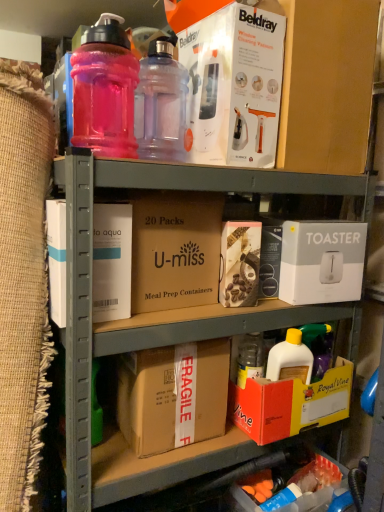
Question: Does orange cardboard box at lower right, the fourth box when ordered from top to bottom, have a lesser width compared to orange cardboard box at lower right, which is the 5th box from top to bottom?

Choices:
 (A) no
 (B) yes

Answer: (A)

Question: Is orange cardboard box at lower right, which is counted as the second box, starting from the bottom, not inside orange cardboard box at lower right, arranged as the first box when ordered from the bottom?

Choices:
 (A) no
 (B) yes

Answer: (B)

Question: From the image's perspective, is orange cardboard box at lower right, the fourth box when ordered from top to bottom, on top of orange cardboard box at lower right, arranged as the first box when ordered from the bottom?

Choices:
 (A) no
 (B) yes

Answer: (B)

Question: Can you confirm if orange cardboard box at lower right, the fourth box when ordered from top to bottom, is positioned to the right of orange cardboard box at lower right, which is the 5th box from top to bottom?

Choices:
 (A) yes
 (B) no

Answer: (B)

Question: Is orange cardboard box at lower right, which is counted as the second box, starting from the bottom, positioned with its back to orange cardboard box at lower right, arranged as the first box when ordered from the bottom?

Choices:
 (A) yes
 (B) no

Answer: (B)

Question: Considering the positions of orange cardboard box at lower right, which is the 5th box from top to bottom, and translucent pink plastic bottle at upper left, the 2th bottle positioned from the right, in the image, is orange cardboard box at lower right, which is the 5th box from top to bottom, taller or shorter than translucent pink plastic bottle at upper left, the 2th bottle positioned from the right,?

Choices:
 (A) tall
 (B) short

Answer: (B)

Question: From the image's perspective, is orange cardboard box at lower right, arranged as the first box when ordered from the bottom, located above or below translucent pink plastic bottle at upper left, the 2th bottle positioned from the right?

Choices:
 (A) below
 (B) above

Answer: (A)

Question: From a real-world perspective, is orange cardboard box at lower right, arranged as the first box when ordered from the bottom, positioned above or below translucent pink plastic bottle at upper left, the 2th bottle positioned from the right?

Choices:
 (A) above
 (B) below

Answer: (B)

Question: In terms of width, does orange cardboard box at lower right, which is the 5th box from top to bottom, look wider or thinner when compared to translucent pink plastic bottle at upper left, the 2th bottle positioned from the right?

Choices:
 (A) wide
 (B) thin

Answer: (B)

Question: Considering the positions of white cardboard toaster at right, which ranks as the third box in top-to-bottom order, and white cardboard box at upper center, which appears as the fifth box when ordered from the bottom, in the image, is white cardboard toaster at right, which ranks as the third box in top-to-bottom order, wider or thinner than white cardboard box at upper center, which appears as the fifth box when ordered from the bottom,?

Choices:
 (A) wide
 (B) thin

Answer: (B)

Question: Considering their positions, is white cardboard toaster at right, which ranks as the third box in top-to-bottom order, located in front of or behind white cardboard box at upper center, the first box from the top?

Choices:
 (A) behind
 (B) front

Answer: (A)

Question: Based on their sizes in the image, would you say white cardboard toaster at right, positioned as the third box in bottom-to-top order, is bigger or smaller than white cardboard box at upper center, which appears as the fifth box when ordered from the bottom?

Choices:
 (A) big
 (B) small

Answer: (B)

Question: In terms of height, does white cardboard toaster at right, which ranks as the third box in top-to-bottom order, look taller or shorter compared to white cardboard box at upper center, the first box from the top?

Choices:
 (A) short
 (B) tall

Answer: (A)

Question: Is brown cardboard box at center, which is counted as the 1th cardboard box, starting from the bottom, inside or outside of brown cardboard at center, placed as the 1th cardboard box when sorted from top to bottom?

Choices:
 (A) outside
 (B) inside

Answer: (A)

Question: Considering the positions of point (201, 425) and point (142, 264), is point (201, 425) closer or farther from the camera than point (142, 264)?

Choices:
 (A) farther
 (B) closer

Answer: (A)